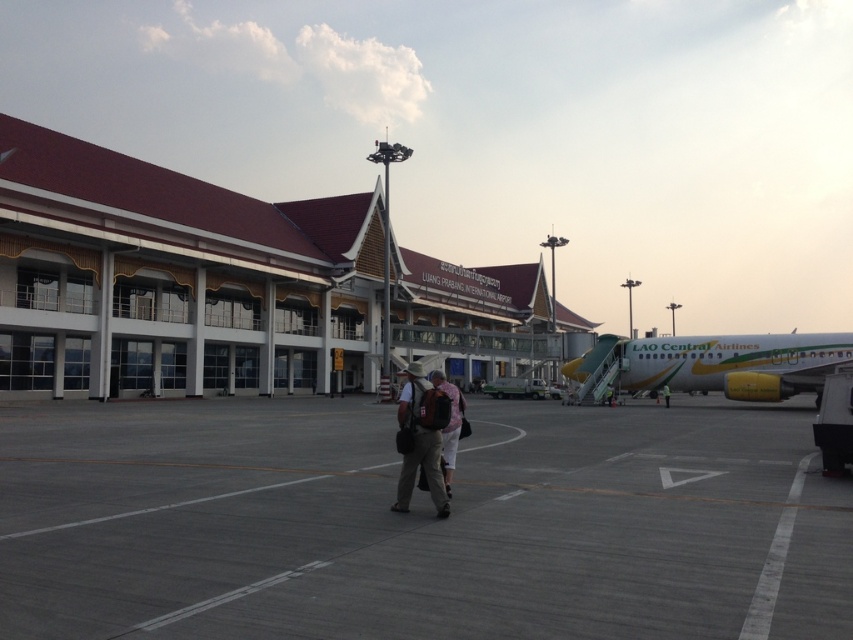
Question: Which object is closer to the camera taking this photo?

Choices:
 (A) gray asphalt tarmac at center
 (B) green/yellow painted airplane at right
 (C) brown fabric backpack at center

Answer: (A)

Question: Which point is closer to the camera?

Choices:
 (A) (679, 356)
 (B) (666, 396)
 (C) (491, 532)
 (D) (436, 400)

Answer: (C)

Question: Is brown fabric backpack at center to the left of matte black backpack at center from the viewer's perspective?

Choices:
 (A) no
 (B) yes

Answer: (B)

Question: Is matte black backpack at center smaller than dark blue uniform at center?

Choices:
 (A) yes
 (B) no

Answer: (B)

Question: Which of the following is the farthest from the observer?

Choices:
 (A) gray asphalt tarmac at center
 (B) matte black backpack at center
 (C) brown fabric backpack at center
 (D) dark blue uniform at center

Answer: (D)

Question: Is matte black backpack at center closer to camera compared to dark blue uniform at center?

Choices:
 (A) no
 (B) yes

Answer: (B)